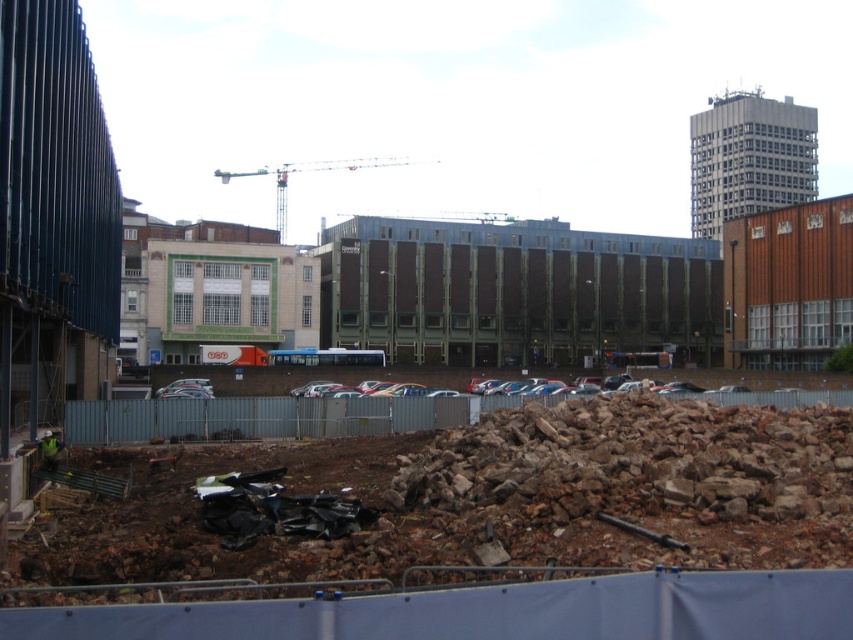
Question: Which object is farther from the camera taking this photo?

Choices:
 (A) rusty concrete rubble at lower center
 (B) metallic gray crane at upper center

Answer: (B)

Question: Does rusty concrete rubble at lower center have a greater width compared to reflective yellow vest at lower left?

Choices:
 (A) yes
 (B) no

Answer: (A)

Question: Which object is the closest to the rusty concrete rubble at lower center?

Choices:
 (A) metallic gray crane at upper center
 (B) reflective yellow vest at lower left

Answer: (B)

Question: Can you confirm if rusty concrete rubble at lower center is positioned below reflective yellow vest at lower left?

Choices:
 (A) no
 (B) yes

Answer: (A)

Question: Among these points, which one is farthest from the camera?

Choices:
 (A) (276, 205)
 (B) (47, 460)
 (C) (502, 410)

Answer: (A)

Question: Observing the image, what is the correct spatial positioning of rusty concrete rubble at lower center in reference to reflective yellow vest at lower left?

Choices:
 (A) above
 (B) below

Answer: (A)